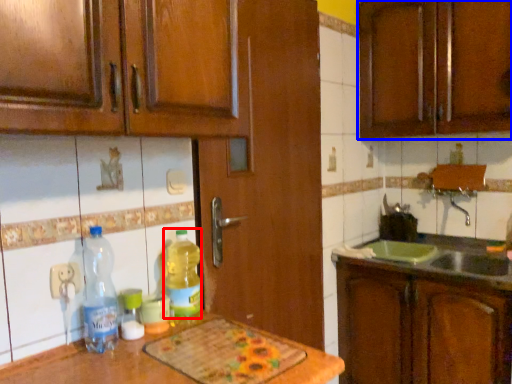
Question: Which object appears farthest to the camera in this image, bottle (highlighted by a red box) or cabinetry (highlighted by a blue box)?

Choices:
 (A) bottle
 (B) cabinetry

Answer: (B)